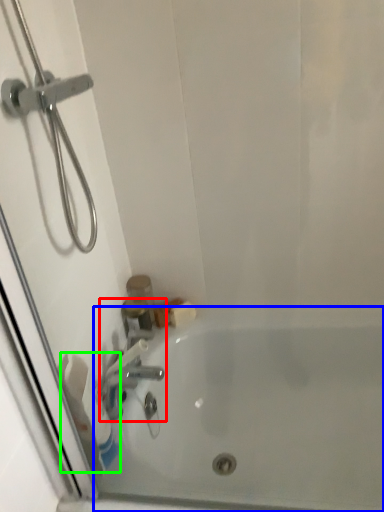
Question: Estimate the real-world distances between objects in this image. Which object is farther from tap (highlighted by a red box), bathtub (highlighted by a blue box) or toilet paper (highlighted by a green box)?

Choices:
 (A) bathtub
 (B) toilet paper

Answer: (A)